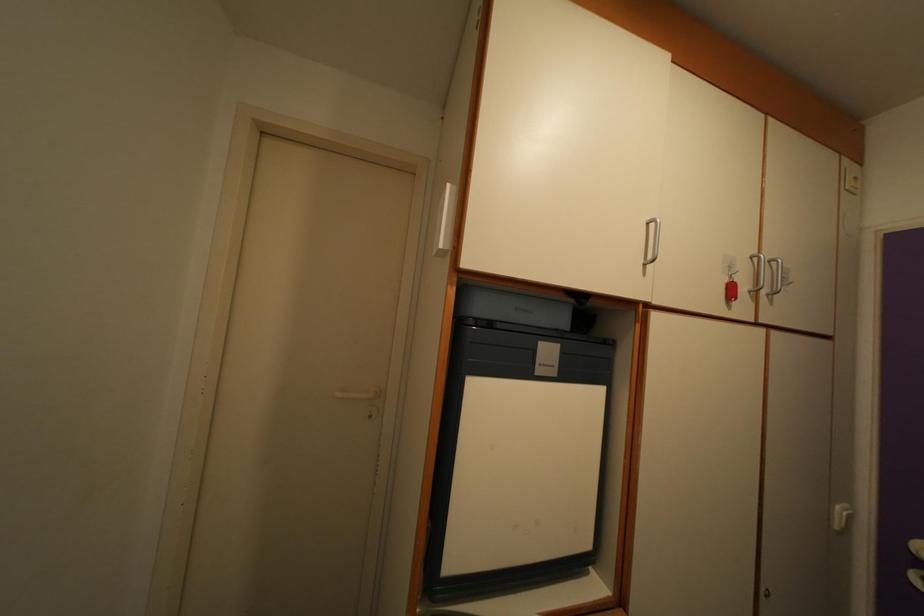
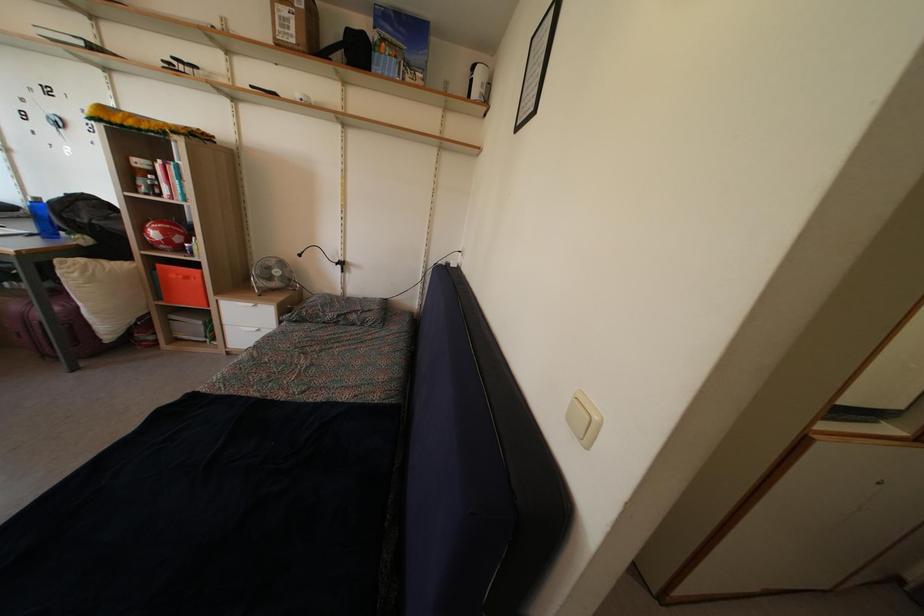
Question: What movement of the cameraman would produce the second image?

Choices:
 (A) Left
 (B) Right
 (C) Forward
 (D) Backward

Answer: (A)